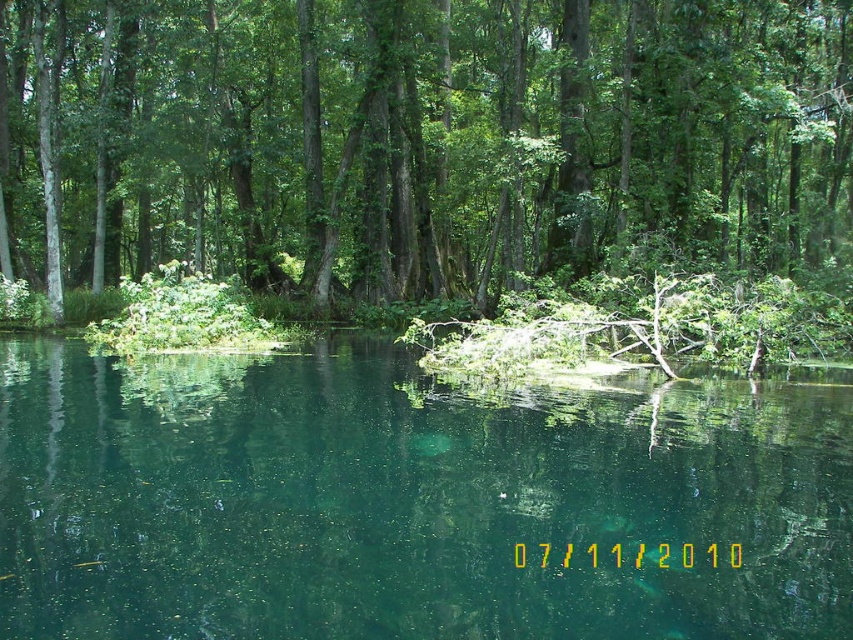
You are standing at the edge of the water and want to see the reflection of the green leafy tree at center in the green translucent water at center. Can you see the reflection clearly?

The green translucent water at center is behind the green leafy tree at center, so the tree blocks the view of its own reflection in the water.